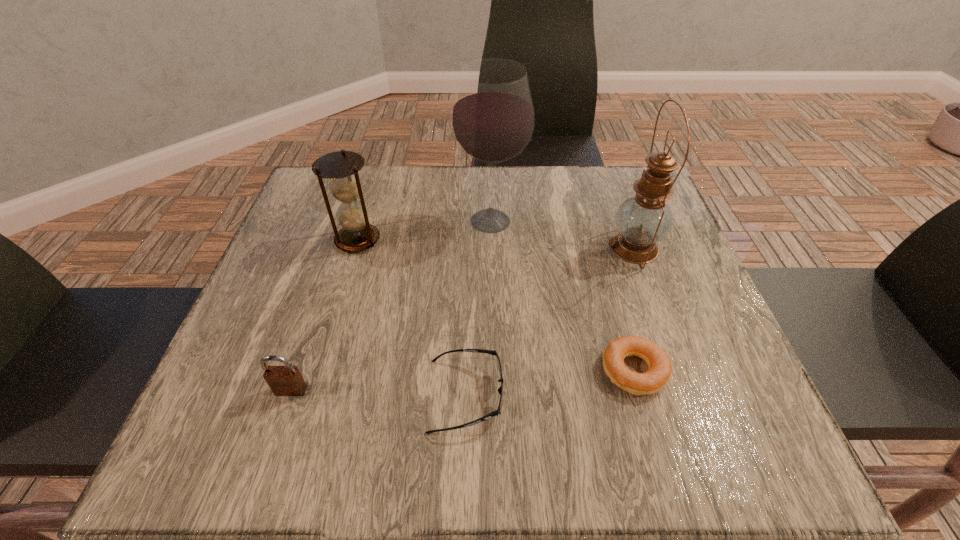
Where is `vacant region located 0.250m on the front-facing side of the sunglasses`? Image resolution: width=960 pixels, height=540 pixels. vacant region located 0.250m on the front-facing side of the sunglasses is located at coordinates (654, 395).

The image size is (960, 540). Identify the location of free spot located 0.280m on the back of the shortest object. (598, 242).

Locate an element on the screen. The image size is (960, 540). object located at the far edge is located at coordinates [x=492, y=119].

At what (x,y) coordinates should I click in order to perform the action: click on object at the near edge. Please return your answer as a coordinate pair (x, y). Looking at the image, I should click on (498, 412).

What are the coordinates of `hourglass located at the left edge` in the screenshot? It's located at (341, 167).

Locate an element on the screen. padlock present at the left edge is located at coordinates (287, 380).

What are the coordinates of `oil lamp that is positioned at the right edge` in the screenshot? It's located at (642, 220).

You are a GUI agent. You are given a task and a screenshot of the screen. Output one action in this format:
    pyautogui.click(x=<x>, y=<y>)
    Task: Click on the bagel at the right edge
    This screenshot has width=960, height=540.
    Given the screenshot: What is the action you would take?
    pyautogui.click(x=659, y=365)

The image size is (960, 540). In order to click on free space at the far edge of the desktop in this screenshot , I will do `click(579, 179)`.

Find the location of a particular element. vacant area at the near edge is located at coordinates (600, 424).